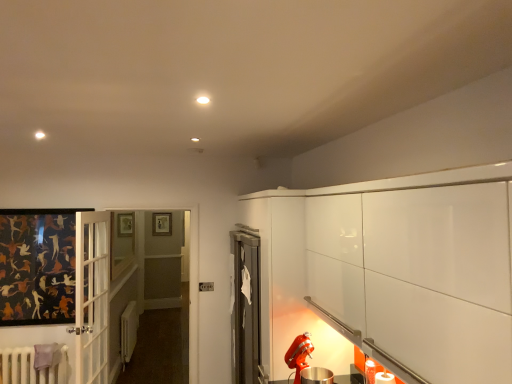
Locate an element on the screen. wooden picture frame at upper center is located at coordinates (162, 224).

The image size is (512, 384). Identify the location of white matte radiator at lower left, the first radiator positioned from the back. (128, 332).

What is the approximate height of clear glass window at center?

30.37 inches.

Identify the location of wooden picture frame at upper center. (162, 224).

Which object is more forward, white painted radiator at lower left, arranged as the 1th radiator when viewed from the front, or white matte radiator at lower left, marked as the 2th radiator in a front-to-back arrangement?

white painted radiator at lower left, arranged as the 1th radiator when viewed from the front, is in front.

From the image's perspective, is white painted radiator at lower left, the 2th radiator from the back, on top of white matte radiator at lower left, marked as the 2th radiator in a front-to-back arrangement?

Indeed, from the image's perspective, white painted radiator at lower left, the 2th radiator from the back, is shown above white matte radiator at lower left, marked as the 2th radiator in a front-to-back arrangement.

How distant is white painted radiator at lower left, arranged as the 1th radiator when viewed from the front, from white matte radiator at lower left, the first radiator positioned from the back?

A distance of 1.61 meters exists between white painted radiator at lower left, arranged as the 1th radiator when viewed from the front, and white matte radiator at lower left, the first radiator positioned from the back.

Which of these two, white painted radiator at lower left, arranged as the 1th radiator when viewed from the front, or white matte radiator at lower left, marked as the 2th radiator in a front-to-back arrangement, is thinner?

white matte radiator at lower left, marked as the 2th radiator in a front-to-back arrangement, is thinner.

From the image's perspective, would you say wooden picture frame at upper center is shown under white matte radiator at lower left, marked as the 2th radiator in a front-to-back arrangement?

No, from the image's perspective, wooden picture frame at upper center is not beneath white matte radiator at lower left, marked as the 2th radiator in a front-to-back arrangement.

Is white matte radiator at lower left, the first radiator positioned from the back, at the back of wooden picture frame at upper center?

wooden picture frame at upper center does not have its back to white matte radiator at lower left, the first radiator positioned from the back.

Is white matte radiator at lower left, the first radiator positioned from the back, surrounded by wooden picture frame at upper center?

No, white matte radiator at lower left, the first radiator positioned from the back, is not surrounded by wooden picture frame at upper center.

Is wooden picture frame at upper center at the right side of white matte radiator at lower left, marked as the 2th radiator in a front-to-back arrangement?

In fact, wooden picture frame at upper center is to the left of white matte radiator at lower left, marked as the 2th radiator in a front-to-back arrangement.

Is wooden picture frame at upper center looking in the opposite direction of white painted radiator at lower left, arranged as the 1th radiator when viewed from the front?

No, wooden picture frame at upper center's orientation is not away from white painted radiator at lower left, arranged as the 1th radiator when viewed from the front.

Is wooden picture frame at upper center in front of or behind white painted radiator at lower left, arranged as the 1th radiator when viewed from the front, in the image?

wooden picture frame at upper center is positioned farther from the viewer than white painted radiator at lower left, arranged as the 1th radiator when viewed from the front.

From the image's perspective, between wooden picture frame at upper center and white painted radiator at lower left, the 2th radiator from the back, who is located below?

white painted radiator at lower left, the 2th radiator from the back, from the image's perspective.

How different are the orientations of white matte radiator at lower left, the first radiator positioned from the back, and white painted radiator at lower left, the 2th radiator from the back, in degrees?

They differ by 88.4 degrees in their facing directions.

From the image's perspective, would you say white matte radiator at lower left, the first radiator positioned from the back, is shown under white painted radiator at lower left, arranged as the 1th radiator when viewed from the front?

Yes.

Is white matte radiator at lower left, marked as the 2th radiator in a front-to-back arrangement, looking in the opposite direction of white painted radiator at lower left, arranged as the 1th radiator when viewed from the front?

No, white matte radiator at lower left, marked as the 2th radiator in a front-to-back arrangement, is not facing away from white painted radiator at lower left, arranged as the 1th radiator when viewed from the front.

Is point (121, 224) farther from camera compared to point (130, 328)?

Yes.

Identify the location of radiator behind the clear glass window at center. (128, 332).

From the image's perspective, relative to white matte radiator at lower left, the first radiator positioned from the back, is clear glass window at center above or below?

Clearly, from the image's perspective, clear glass window at center is above white matte radiator at lower left, the first radiator positioned from the back.

Is clear glass window at center beside white matte radiator at lower left, marked as the 2th radiator in a front-to-back arrangement?

There is a gap between clear glass window at center and white matte radiator at lower left, marked as the 2th radiator in a front-to-back arrangement.

Considering the sizes of objects clear glass window at center and wooden picture frame at upper center in the image provided, who is bigger, clear glass window at center or wooden picture frame at upper center?

Bigger between the two is clear glass window at center.

From the image's perspective, is clear glass window at center on wooden picture frame at upper center?

No, from the image's perspective, clear glass window at center is not on top of wooden picture frame at upper center.

Which object is further away from the camera taking this photo, clear glass window at center or wooden picture frame at upper center?

wooden picture frame at upper center.

Are clear glass window at center and wooden picture frame at upper center beside each other?

clear glass window at center and wooden picture frame at upper center are not in contact.

From the image's perspective, is white painted radiator at lower left, arranged as the 1th radiator when viewed from the front, over clear glass window at center?

No, from the image's perspective, white painted radiator at lower left, arranged as the 1th radiator when viewed from the front, is not on top of clear glass window at center.

From a real-world perspective, is white painted radiator at lower left, arranged as the 1th radiator when viewed from the front, on top of clear glass window at center?

No, from a real-world perspective, white painted radiator at lower left, arranged as the 1th radiator when viewed from the front, is not above clear glass window at center.

Is white painted radiator at lower left, the 2th radiator from the back, surrounding clear glass window at center?

Definitely not — clear glass window at center is not inside white painted radiator at lower left, the 2th radiator from the back.

The width and height of the screenshot is (512, 384). Identify the location of radiator that is above the white matte radiator at lower left, marked as the 2th radiator in a front-to-back arrangement (from the image's perspective). (31, 367).

Image resolution: width=512 pixels, height=384 pixels. I want to click on picture frame lying behind the white matte radiator at lower left, marked as the 2th radiator in a front-to-back arrangement, so click(162, 224).

Considering their positions, is white painted radiator at lower left, the 2th radiator from the back, positioned further to clear glass window at center than white matte radiator at lower left, marked as the 2th radiator in a front-to-back arrangement?

Among the two, white painted radiator at lower left, the 2th radiator from the back, is located further to clear glass window at center.

When comparing their distances from wooden picture frame at upper center, does clear glass window at center or white painted radiator at lower left, arranged as the 1th radiator when viewed from the front, seem further?

white painted radiator at lower left, arranged as the 1th radiator when viewed from the front.

In the scene shown: From the image, which object appears to be farther from wooden picture frame at upper center, clear glass window at center or white matte radiator at lower left, marked as the 2th radiator in a front-to-back arrangement?

Among the two, white matte radiator at lower left, marked as the 2th radiator in a front-to-back arrangement, is located further to wooden picture frame at upper center.

Estimate the real-world distances between objects in this image. Which object is further from clear glass window at center, wooden picture frame at upper center or white matte radiator at lower left, the first radiator positioned from the back?

Based on the image, wooden picture frame at upper center appears to be further to clear glass window at center.

When comparing their distances from white matte radiator at lower left, marked as the 2th radiator in a front-to-back arrangement, does white painted radiator at lower left, the 2th radiator from the back, or wooden picture frame at upper center seem closer?

The object closer to white matte radiator at lower left, marked as the 2th radiator in a front-to-back arrangement, is white painted radiator at lower left, the 2th radiator from the back.

From the image, which object appears to be nearer to white painted radiator at lower left, the 2th radiator from the back, wooden picture frame at upper center or clear glass window at center?

clear glass window at center is closer to white painted radiator at lower left, the 2th radiator from the back.

Estimate the real-world distances between objects in this image. Which object is further from white matte radiator at lower left, the first radiator positioned from the back, clear glass window at center or white painted radiator at lower left, the 2th radiator from the back?

white painted radiator at lower left, the 2th radiator from the back, is further to white matte radiator at lower left, the first radiator positioned from the back.

Based on their spatial positions, is white matte radiator at lower left, marked as the 2th radiator in a front-to-back arrangement, or white painted radiator at lower left, arranged as the 1th radiator when viewed from the front, further from wooden picture frame at upper center?

white painted radiator at lower left, arranged as the 1th radiator when viewed from the front.

Identify the location of radiator positioned between white painted radiator at lower left, the 2th radiator from the back, and wooden picture frame at upper center from near to far. (128, 332).

Image resolution: width=512 pixels, height=384 pixels. In order to click on window between white painted radiator at lower left, the 2th radiator from the back, and white matte radiator at lower left, marked as the 2th radiator in a front-to-back arrangement, from front to back in this screenshot , I will do `click(121, 242)`.

At what (x,y) coordinates should I click in order to perform the action: click on window between white painted radiator at lower left, the 2th radiator from the back, and wooden picture frame at upper center, along the z-axis. Please return your answer as a coordinate pair (x, y). This screenshot has width=512, height=384. Looking at the image, I should click on (121, 242).

Locate an element on the screen. This screenshot has height=384, width=512. radiator between clear glass window at center and wooden picture frame at upper center along the z-axis is located at coordinates (128, 332).